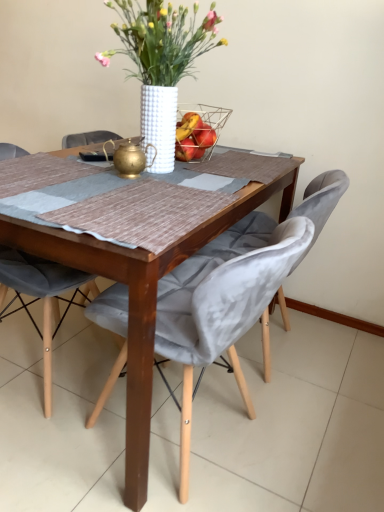
What are the coordinates of `free location to the right of gold metallic teapot at center` in the screenshot? It's located at (182, 180).